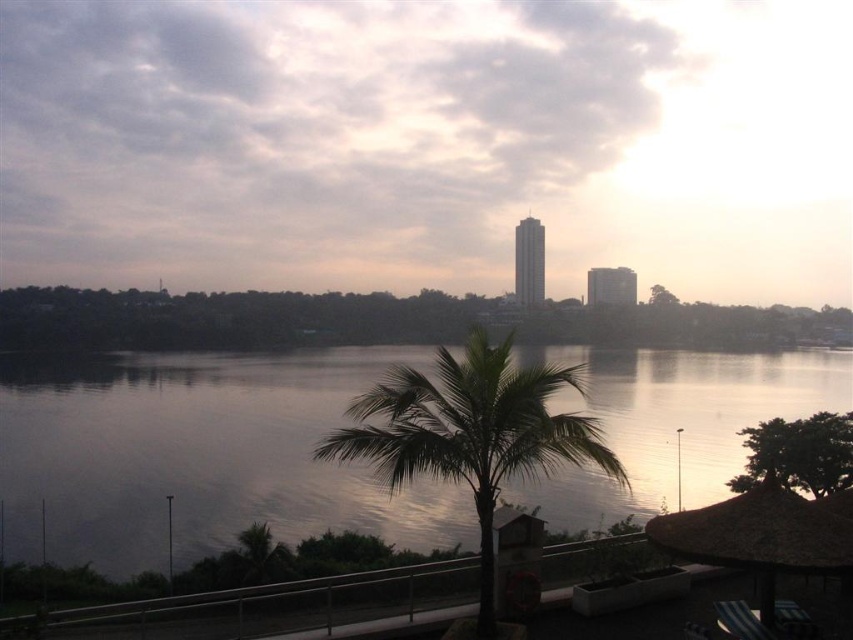
You are a kayaker planning to navigate between the silvery reflective water at center and the green leafy palm tree at center. Given that your kayak is 2 meters long, can you safely pass through the gap between them?

The distance between the silvery reflective water at center and the green leafy palm tree at center is 17.52 meters, which is more than sufficient for your 2 meter long kayak to safely pass through the gap between them.

You are standing at the riverside and want to take a photo of both the silvery reflective water at center and the green leafy palm tree at center. Based on their positions, which object should you position closer to the left side of your camera frame?

The silvery reflective water at center should be positioned closer to the left side of your camera frame because it is located to the left of the green leafy palm tree at center.

You are an artist planning to paint the riverside scene. You want to ensure the silvery reflective water at center and the green leafy palm tree at center are proportionally accurate. Which object should you make larger in your painting?

The silvery reflective water at center should be made larger in the painting since it has a larger size compared to the green leafy palm tree at center according to the description.